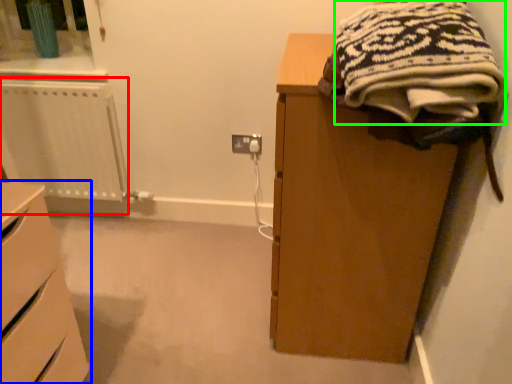
Question: Which object is the farthest from radiator (highlighted by a red box)? Choose among these: chest of drawers (highlighted by a blue box) or clothing (highlighted by a green box).

Choices:
 (A) chest of drawers
 (B) clothing

Answer: (B)